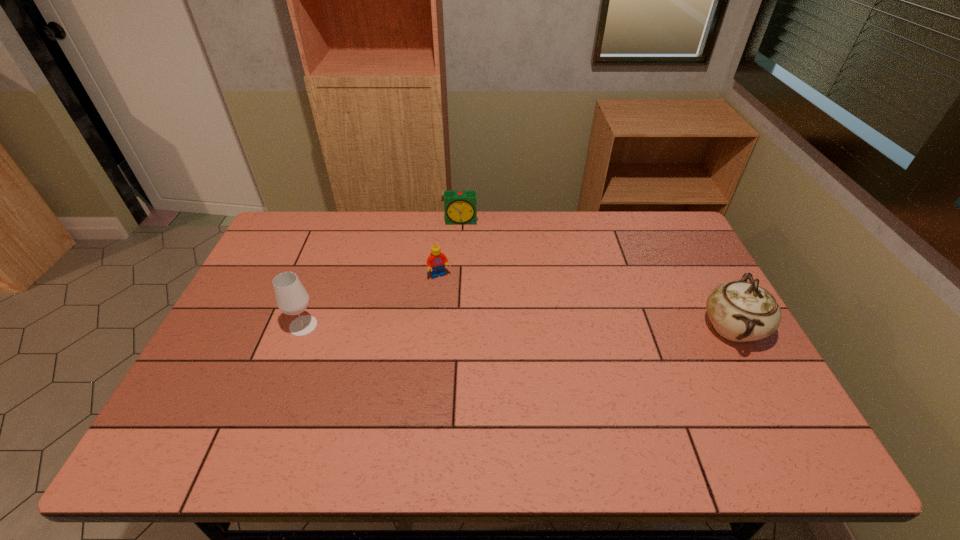
You are a GUI agent. You are given a task and a screenshot of the screen. Output one action in this format:
    pyautogui.click(x=<x>, y=<y>)
    Task: Click on the free area in between the glass and the rightmost object
    
    Given the screenshot: What is the action you would take?
    pyautogui.click(x=517, y=327)

Select which object appears as the closest to the chinaware. Please provide its 2D coordinates. Your answer should be formatted as a tuple, i.e. [(x, y)], where the tuple contains the x and y coordinates of a point satisfying the conditions above.

[(435, 262)]

The image size is (960, 540). In order to click on object that can be found as the third closest to the second farthest object in this screenshot , I will do click(740, 311).

Find the location of a particular element. vacant space that satisfies the following two spatial constraints: 1. on the front side of the farthest object; 2. on the left side of the chinaware is located at coordinates (456, 328).